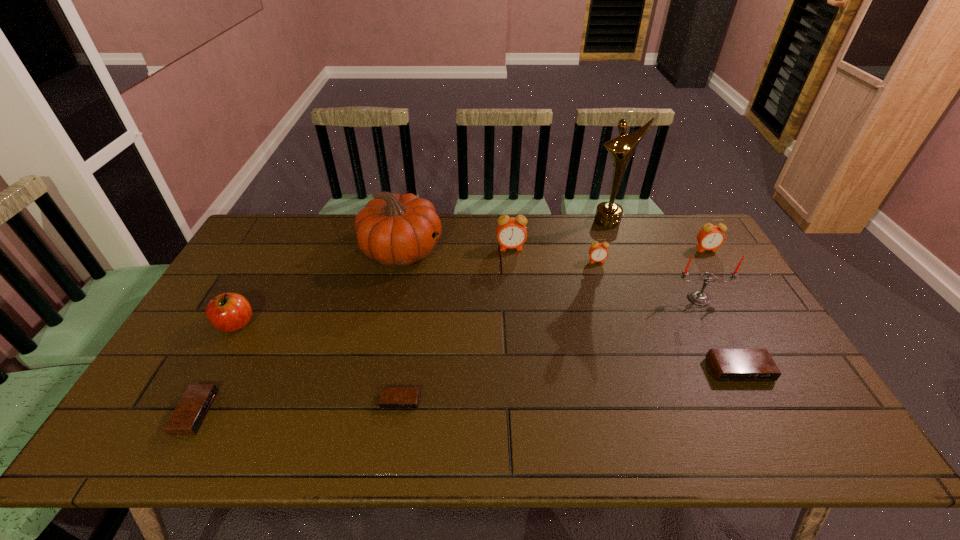
This screenshot has width=960, height=540. I want to click on object positioned at the near edge, so click(189, 414).

Where is `apple located at the left edge`? The height and width of the screenshot is (540, 960). apple located at the left edge is located at coordinates (228, 312).

Locate an element on the screen. This screenshot has width=960, height=540. alarm clock that is positioned at the left edge is located at coordinates (189, 414).

Where is `candle that is positioned at the right edge`? Image resolution: width=960 pixels, height=540 pixels. candle that is positioned at the right edge is located at coordinates (698, 297).

Find the location of `object that is at the near left corner`. object that is at the near left corner is located at coordinates (189, 414).

In order to click on object at the far right corner in this screenshot , I will do `click(710, 237)`.

This screenshot has height=540, width=960. In order to click on vacant space at the far edge of the desktop in this screenshot , I will do coord(484,217).

This screenshot has height=540, width=960. I want to click on free space at the near edge of the desktop, so click(513, 433).

Find the location of `free space at the right edge of the desktop`. free space at the right edge of the desktop is located at coordinates (815, 408).

The width and height of the screenshot is (960, 540). In the image, there is a desktop. Identify the location of vacant space at the far left corner. (291, 234).